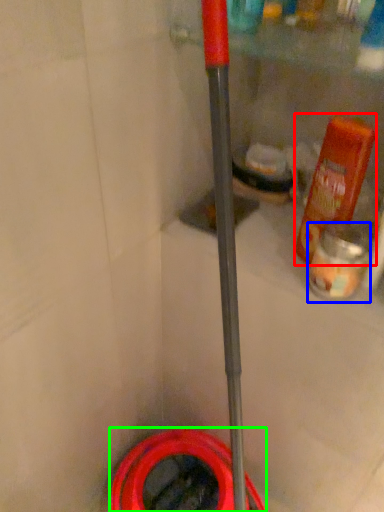
Question: Which object is positioned closest to bottle (highlighted by a red box)? Select from cleaning product (highlighted by a blue box) and garden hose (highlighted by a green box).

Choices:
 (A) cleaning product
 (B) garden hose

Answer: (A)